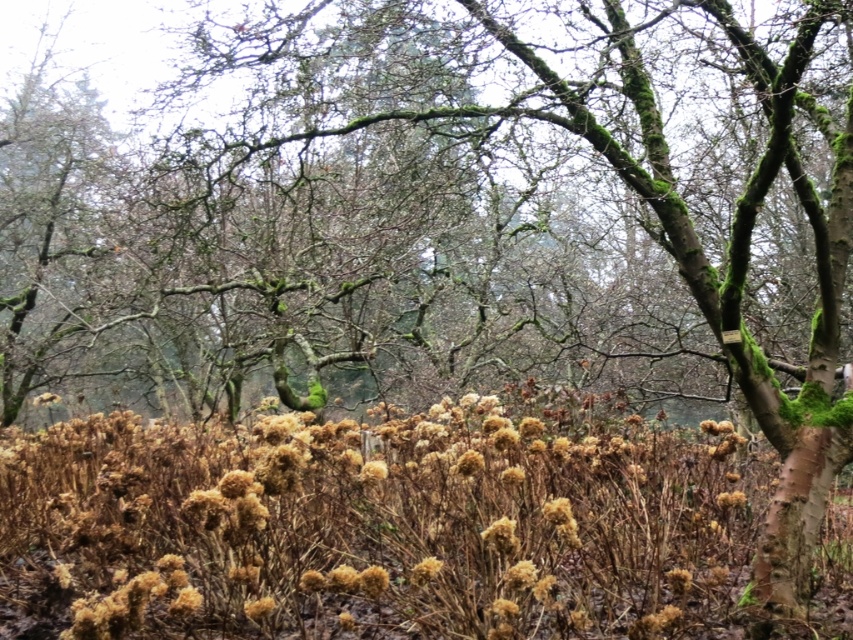
Question: Does brown fluffy plant at center come in front of brown fluffy flower at center?

Choices:
 (A) no
 (B) yes

Answer: (B)

Question: Does brown fluffy plant at center lie in front of brown fluffy flower at center?

Choices:
 (A) yes
 (B) no

Answer: (A)

Question: Considering the relative positions of brown fluffy plant at center and brown fluffy flower at center in the image provided, where is brown fluffy plant at center located with respect to brown fluffy flower at center?

Choices:
 (A) left
 (B) right

Answer: (A)

Question: Among these objects, which one is farthest from the camera?

Choices:
 (A) brown fluffy flower at center
 (B) brown fluffy plant at center

Answer: (A)